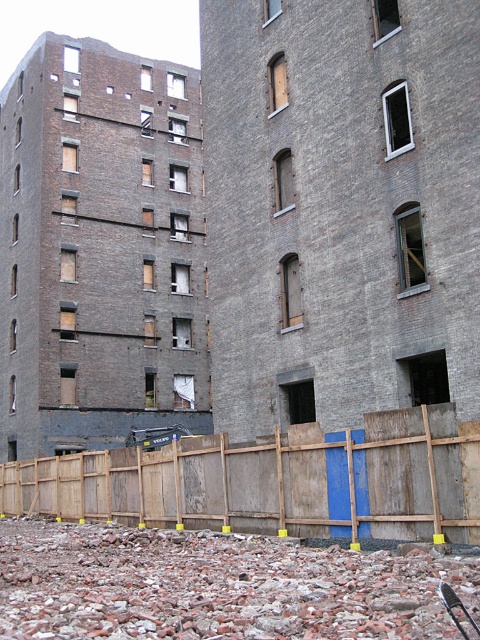
Between point (139, 196) and point (109, 563), which one is positioned behind?

Point (139, 196)

Between dark gray brick building at left and rusty gravel pile at lower center, which one has less height?

With less height is rusty gravel pile at lower center.

Locate an element on the screen. This screenshot has height=640, width=480. dark gray brick building at left is located at coordinates (99, 250).

Is dark gray brick building at left above wooden fence at lower center?

Correct, dark gray brick building at left is located above wooden fence at lower center.

Does dark gray brick building at left have a greater width compared to wooden fence at lower center?

Yes, dark gray brick building at left is wider than wooden fence at lower center.

Identify the location of dark gray brick building at left. (99, 250).

The width and height of the screenshot is (480, 640). Describe the element at coordinates (216, 586) in the screenshot. I see `rusty gravel pile at lower center` at that location.

Between rusty gravel pile at lower center and wooden fence at lower center, which one appears on the right side from the viewer's perspective?

rusty gravel pile at lower center is more to the right.

I want to click on rusty gravel pile at lower center, so click(x=216, y=586).

Locate an element on the screen. This screenshot has height=640, width=480. rusty gravel pile at lower center is located at coordinates (216, 586).